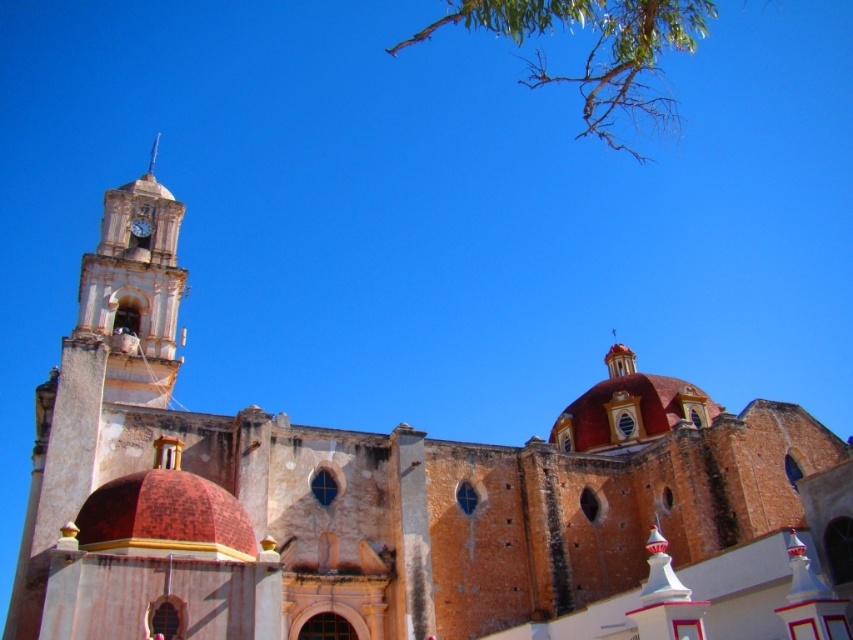
You are standing at the entrance of the historic church and want to take a photo of the white stone clock tower at upper left. The camera you have can focus on objects up to 50 meters away. Will the tower be in focus?

The white stone clock tower at upper left is 56.79 meters away from the camera, which exceeds the camera maximum focus range of 50 meters. Therefore, the tower will not be in focus.

From the picture: You are standing in front of the historic church and want to take a photo that includes both the white stone clock tower at upper left and the metallic gold clock at upper left. Based on their positions, which object should you position to the left side of your camera frame to include both?

You should position the white stone clock tower at upper left to the left side of your camera frame since it is located to the left of the metallic gold clock at upper left.

You are standing in front of the historic church and notice the green leafy branches at upper center and the metallic gold clock at upper left. Which object appears closer to you, and why?

The green leafy branches at upper center appear closer because they are positioned in front of the metallic gold clock at upper left.